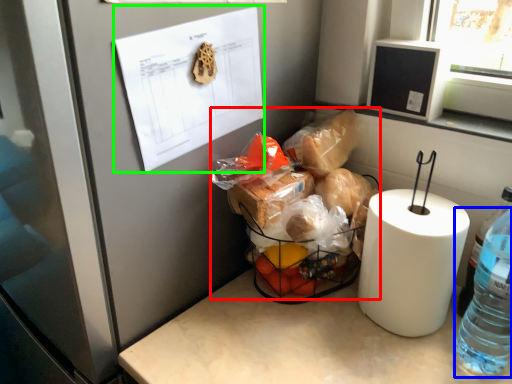
Question: Which is nearer to the waste (highlighted by a red box)? bottle (highlighted by a blue box) or paper (highlighted by a green box).

Choices:
 (A) bottle
 (B) paper

Answer: (B)